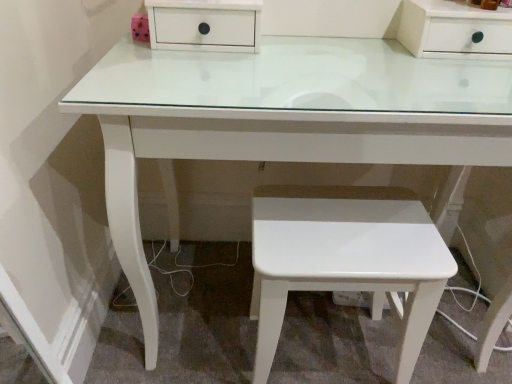
Question: Should I look upward or downward to see white glossy stool at lower center?

Choices:
 (A) down
 (B) up

Answer: (A)